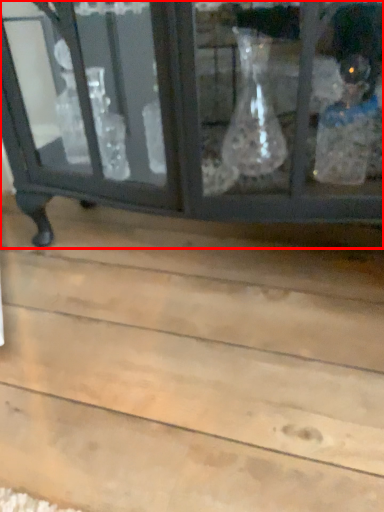
Question: From the image's perspective, considering the relative positions of furniture (annotated by the red box) and plank in the image provided, where is furniture (annotated by the red box) located with respect to the staircase?

Choices:
 (A) below
 (B) above

Answer: (B)